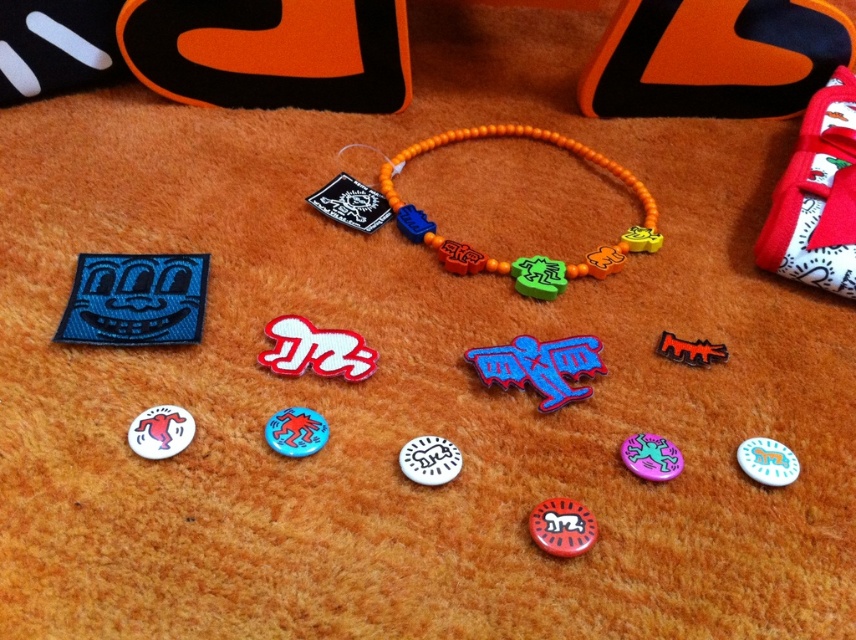
Is the position of orange wooden beads at center more distant than that of white matte badge at center?

Yes.

Does orange wooden beads at center appear over white matte badge at center?

Yes, orange wooden beads at center is above white matte badge at center.

This screenshot has height=640, width=856. Identify the location of orange wooden beads at center. (520, 257).

Based on the photo, does blue glossy pin at center have a lesser height compared to red glossy magnet at center?

Incorrect, blue glossy pin at center's height does not fall short of red glossy magnet at center's.

How much distance is there between blue glossy pin at center and red glossy magnet at center?

blue glossy pin at center and red glossy magnet at center are 9.58 inches apart from each other.

Is point (520, 376) positioned before point (266, 330)?

Yes.

The height and width of the screenshot is (640, 856). I want to click on blue glossy pin at center, so click(539, 365).

Who is taller, velvet fabric toy at upper right or white glossy badge at lower left?

Standing taller between the two is velvet fabric toy at upper right.

Measure the distance between velvet fabric toy at upper right and white glossy badge at lower left.

velvet fabric toy at upper right is 3.90 feet from white glossy badge at lower left.

Image resolution: width=856 pixels, height=640 pixels. In order to click on velvet fabric toy at upper right in this screenshot , I will do `click(817, 196)`.